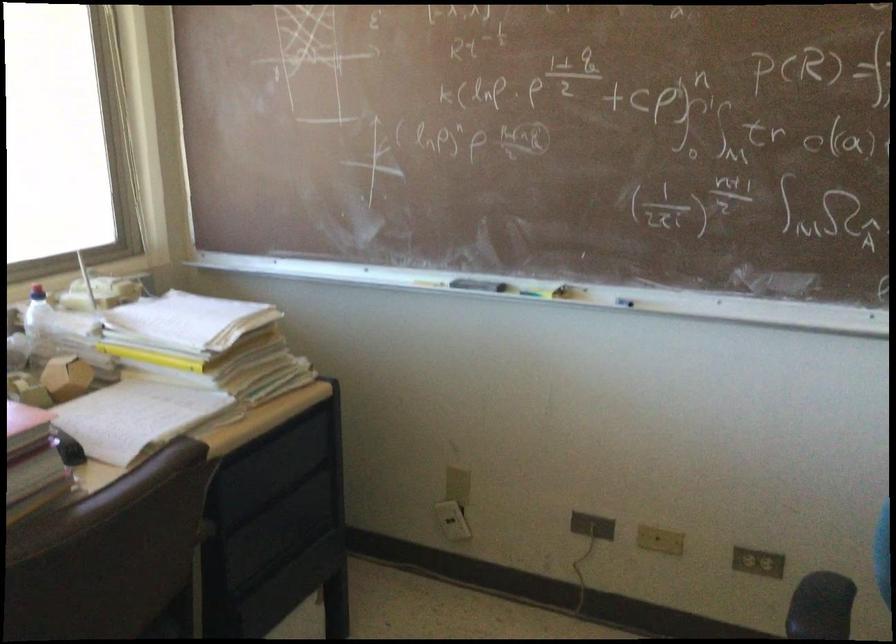
Describe the element at coordinates (298, 506) in the screenshot. I see `the black drawer pull` at that location.